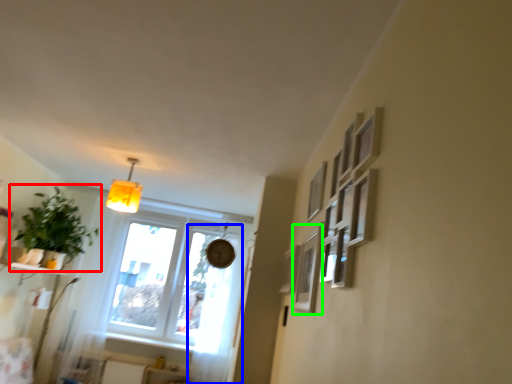
Question: Which is farther away from houseplant (highlighted by a red box)? curtain (highlighted by a blue box) or picture frame (highlighted by a green box)?

Choices:
 (A) curtain
 (B) picture frame

Answer: (B)